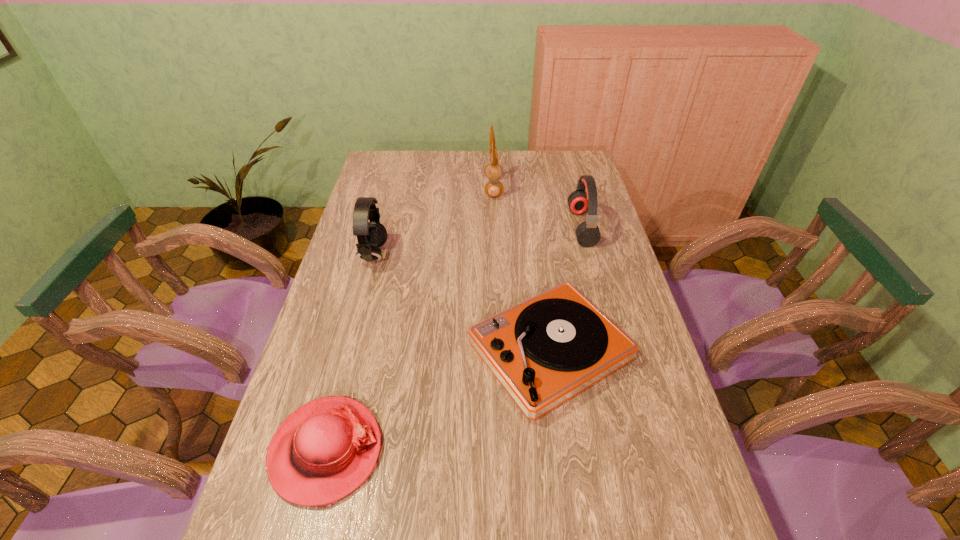
Where is `free space located 0.380m on the ear cups of the rightmost earphone`? The width and height of the screenshot is (960, 540). free space located 0.380m on the ear cups of the rightmost earphone is located at coordinates (465, 227).

You are a GUI agent. You are given a task and a screenshot of the screen. Output one action in this format:
    pyautogui.click(x=<x>, y=<y>)
    Task: Click on the free spot located on the ear cups of the rightmost earphone
    This screenshot has height=540, width=960.
    Given the screenshot: What is the action you would take?
    pyautogui.click(x=481, y=227)

Where is `vacant area situated on the ear cups of the rightmost earphone`? vacant area situated on the ear cups of the rightmost earphone is located at coordinates (537, 227).

Identify the location of vacant space located at the front of the hat with a bow. (511, 450).

Where is `vacant space located 0.270m on the left of the record player`? vacant space located 0.270m on the left of the record player is located at coordinates (369, 351).

Identify the location of object located at the far edge. [494, 188].

The image size is (960, 540). In order to click on earphone at the left edge in this screenshot , I will do `click(371, 235)`.

Where is `hat present at the left edge`? hat present at the left edge is located at coordinates (323, 451).

At what (x,y) coordinates should I click in order to perform the action: click on earphone that is at the right edge. Please return your answer as a coordinate pair (x, y). This screenshot has height=540, width=960. Looking at the image, I should click on (588, 234).

The width and height of the screenshot is (960, 540). In order to click on record player that is at the right edge in this screenshot , I will do `click(545, 350)`.